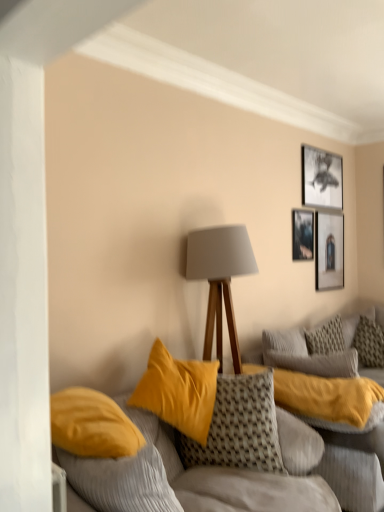
Question: Is textured gray pillow at right, marked as the 2th pillow in a front-to-back arrangement, positioned behind black matte picture frame at upper right, the first picture frame when ordered from top to bottom?

Choices:
 (A) yes
 (B) no

Answer: (B)

Question: From the image's perspective, is textured gray pillow at right, the second pillow from the left, under black matte picture frame at upper right, which is counted as the 3th picture frame, starting from the bottom?

Choices:
 (A) no
 (B) yes

Answer: (B)

Question: From the image's perspective, is textured gray pillow at right, the second pillow from the left, over black matte picture frame at upper right, which is counted as the 3th picture frame, starting from the bottom?

Choices:
 (A) no
 (B) yes

Answer: (A)

Question: Is textured gray pillow at right, placed as the first pillow when sorted from right to left, in front of black matte picture frame at upper right, the first picture frame when ordered from top to bottom?

Choices:
 (A) no
 (B) yes

Answer: (B)

Question: Is textured gray pillow at right, placed as the first pillow when sorted from right to left, turned away from black matte picture frame at upper right, which is counted as the 3th picture frame, starting from the bottom?

Choices:
 (A) no
 (B) yes

Answer: (A)

Question: Are textured gray pillow at right, placed as the first pillow when sorted from right to left, and black matte picture frame at upper right, the first picture frame when ordered from top to bottom, located far from each other?

Choices:
 (A) yes
 (B) no

Answer: (A)

Question: Is velvet yellow cushions at center beside matte black picture frame at upper right, which is the first picture frame in bottom-to-top order?

Choices:
 (A) yes
 (B) no

Answer: (B)

Question: Can you confirm if velvet yellow cushions at center is wider than matte black picture frame at upper right, which is the first picture frame in bottom-to-top order?

Choices:
 (A) yes
 (B) no

Answer: (A)

Question: Does velvet yellow cushions at center have a greater height compared to matte black picture frame at upper right, which is the first picture frame in bottom-to-top order?

Choices:
 (A) no
 (B) yes

Answer: (B)

Question: Can you confirm if velvet yellow cushions at center is smaller than matte black picture frame at upper right, which is the first picture frame in bottom-to-top order?

Choices:
 (A) yes
 (B) no

Answer: (B)

Question: Would you say velvet yellow cushions at center is a long distance from matte black picture frame at upper right, which is the first picture frame in bottom-to-top order?

Choices:
 (A) no
 (B) yes

Answer: (B)

Question: From the image's perspective, is velvet yellow cushions at center above matte black picture frame at upper right, which is counted as the third picture frame, starting from the top?

Choices:
 (A) no
 (B) yes

Answer: (A)

Question: From the image's perspective, is matte black picture frame at upper right, which is counted as the third picture frame, starting from the top, over textured woven pillow at center, which ranks as the 1th pillow in left-to-right order?

Choices:
 (A) yes
 (B) no

Answer: (A)